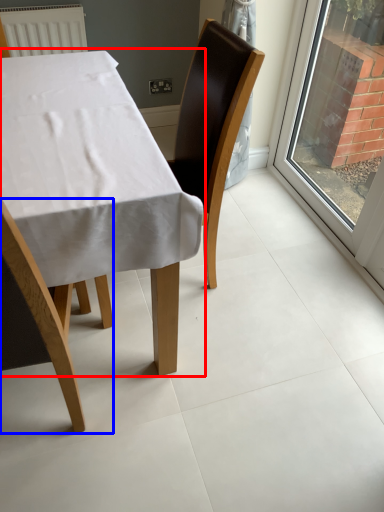
Question: Which object appears closest to the camera in this image, table (highlighted by a red box) or chair (highlighted by a blue box)?

Choices:
 (A) table
 (B) chair

Answer: (B)